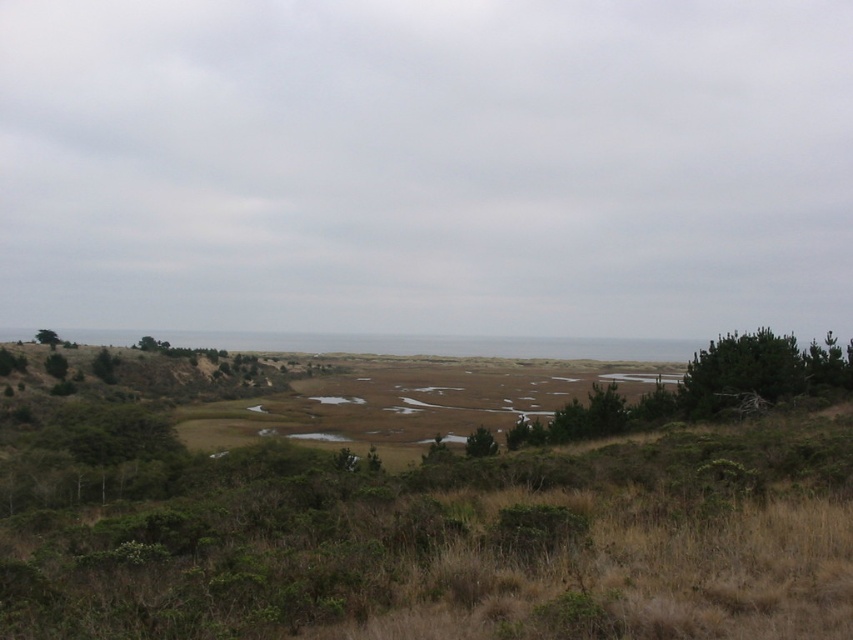
Does green matte tree at right come behind green matte tree at upper left?

That is False.

Can you confirm if green matte tree at right is wider than green matte tree at upper left?

Incorrect, green matte tree at right's width does not surpass green matte tree at upper left's.

Measure the distance between point (695, 396) and camera.

Point (695, 396) and camera are 29.72 meters apart from each other.

I want to click on green matte tree at right, so click(759, 372).

Which is more to the left, green matte tree at center or green matte tree at upper left?

green matte tree at upper left is more to the left.

Locate an element on the screen. Image resolution: width=853 pixels, height=640 pixels. green matte tree at center is located at coordinates (480, 444).

At what (x,y) coordinates should I click in order to perform the action: click on green matte tree at center. Please return your answer as a coordinate pair (x, y). The image size is (853, 640). Looking at the image, I should click on (480, 444).

Does green matte tree at right appear on the left side of green matte tree at center?

In fact, green matte tree at right is to the right of green matte tree at center.

Measure the distance between point (x=755, y=390) and camera.

The distance of point (x=755, y=390) from camera is 28.78 meters.

Is point (704, 364) closer to viewer compared to point (479, 442)?

That is False.

Where is `green matte tree at right`? The width and height of the screenshot is (853, 640). green matte tree at right is located at coordinates (759, 372).